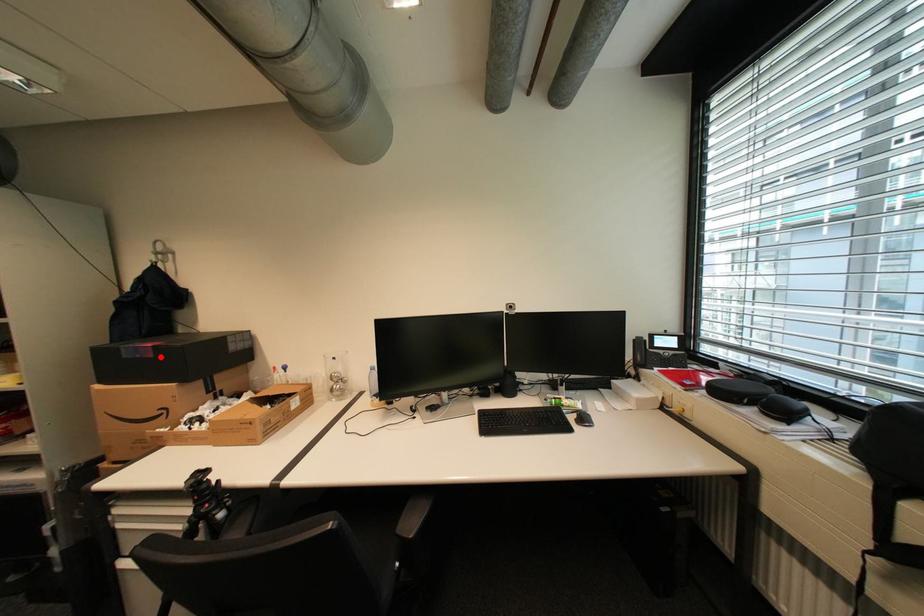
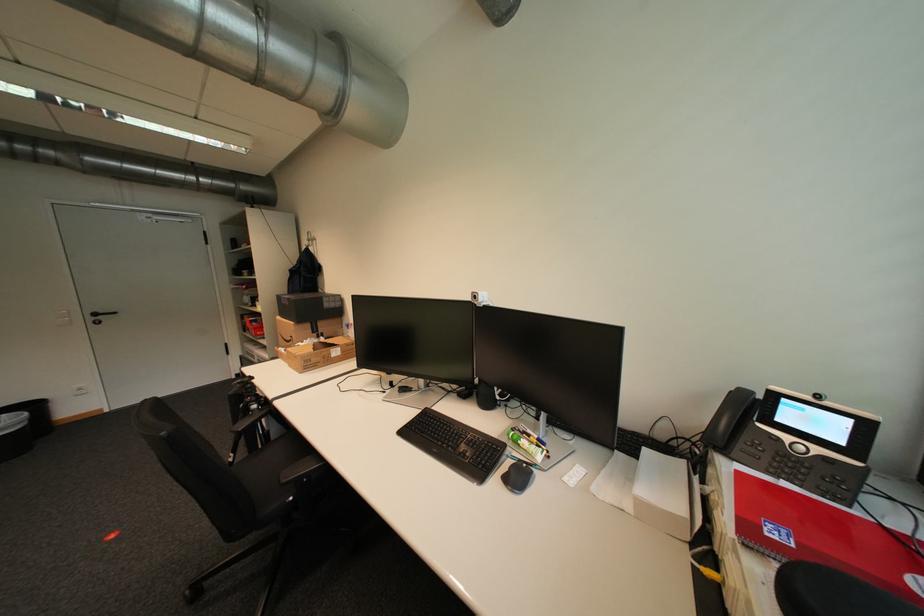
Where in the second image is the point corresponding to the highlighted location from the first image?

(296, 305)